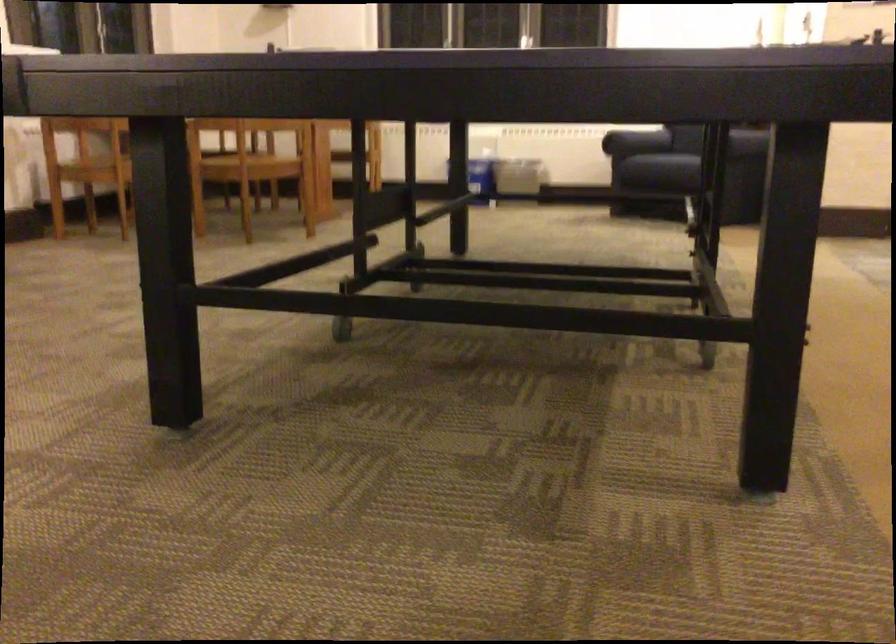
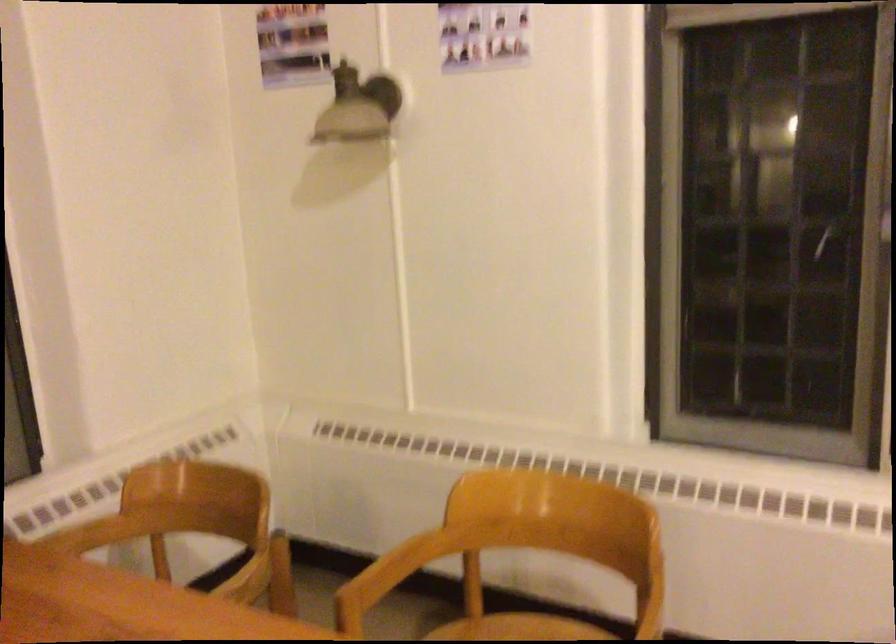
Locate, in the second image, the point that corresponds to [218,138] in the first image.

(92, 534)